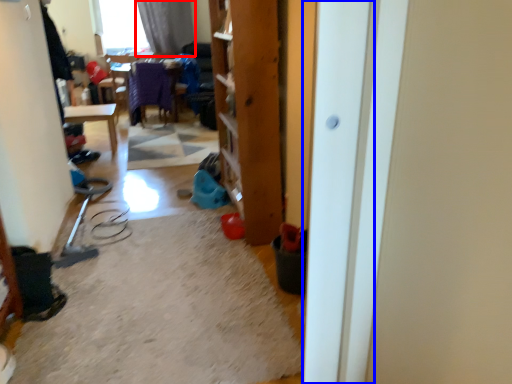
Question: Which point is further to the camera, curtain (highlighted by a red box) or screen door (highlighted by a blue box)?

Choices:
 (A) curtain
 (B) screen door

Answer: (A)